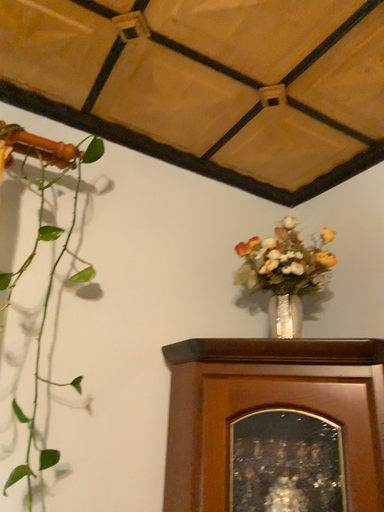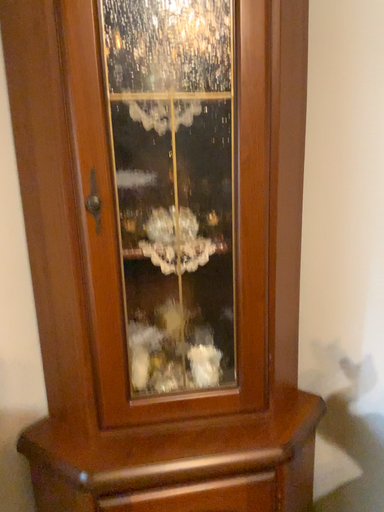
Question: Which way did the camera rotate in the video?

Choices:
 (A) rotated right
 (B) rotated left

Answer: (A)